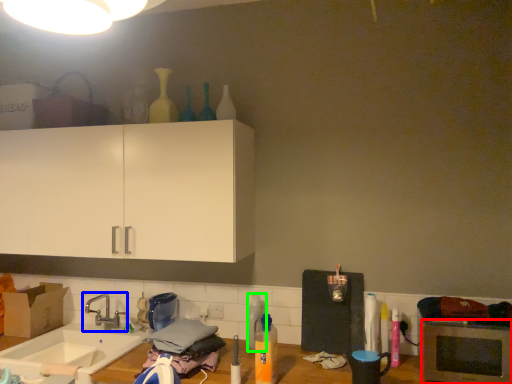
Question: Which object is positioned farthest from microwave oven (highlighted by a red box)? Select from tap (highlighted by a blue box) and bottle (highlighted by a green box).

Choices:
 (A) tap
 (B) bottle

Answer: (A)